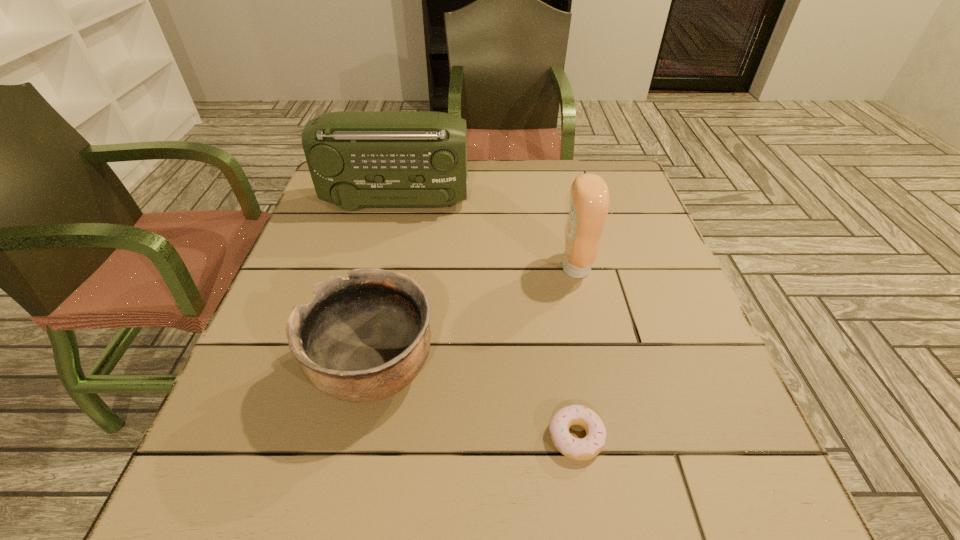
The width and height of the screenshot is (960, 540). In order to click on object present at the far edge in this screenshot , I will do `click(356, 159)`.

Identify the location of object at the near edge. (591, 445).

I want to click on radio_receiver positioned at the left edge, so click(356, 159).

The width and height of the screenshot is (960, 540). In order to click on pottery at the left edge in this screenshot , I will do `click(362, 339)`.

Locate an element on the screen. object that is positioned at the far left corner is located at coordinates (356, 159).

Image resolution: width=960 pixels, height=540 pixels. In the image, there is a desktop. Find the location of `free region at the far edge`. free region at the far edge is located at coordinates (555, 172).

The image size is (960, 540). Find the location of `free region at the near edge of the desktop`. free region at the near edge of the desktop is located at coordinates (543, 500).

At what (x,y) coordinates should I click in order to perform the action: click on free region at the left edge of the desktop. Please return your answer as a coordinate pair (x, y). The width and height of the screenshot is (960, 540). Looking at the image, I should click on (232, 393).

In the image, there is a desktop. In order to click on free space at the right edge in this screenshot , I will do `click(660, 305)`.

Where is `vacant area between the radio_receiver and the third nearest object`? vacant area between the radio_receiver and the third nearest object is located at coordinates (486, 235).